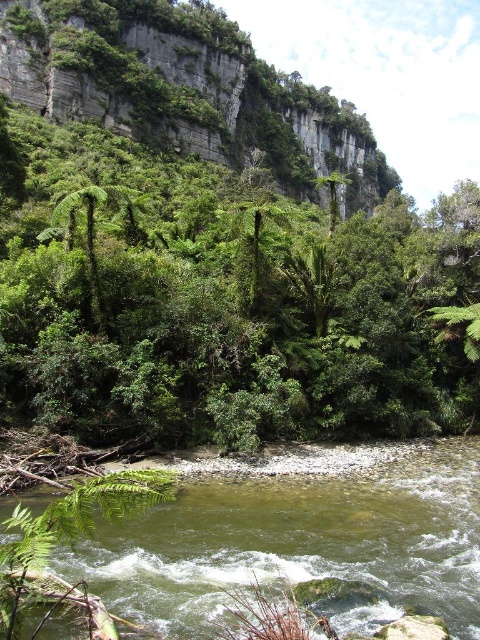
You are an explorer navigating a dense forest. You see the green smooth water at center and the green leafy hillside at upper left. Which of these two features is narrower in width?

The green smooth water at center is thinner than the green leafy hillside at upper left, so the green smooth water at center is narrower in width.

You are standing on the riverbank and want to take a photo of both the green smooth water at center and the green leafy hillside at upper left. Which object should you adjust your camera to focus on first if you want to capture both in the same frame?

The green smooth water at center is to the left of green leafy hillside at upper left, so you should focus on the green leafy hillside at upper left first to ensure both are in the frame.

You are an environmental scientist assessing the landscape. You need to determine which object, the green leafy tree at center or the green leafy hillside at upper left, has a greater height. Based on the scene, which one is taller?

The green leafy tree at center is taller than the green leafy hillside at upper left according to the description.